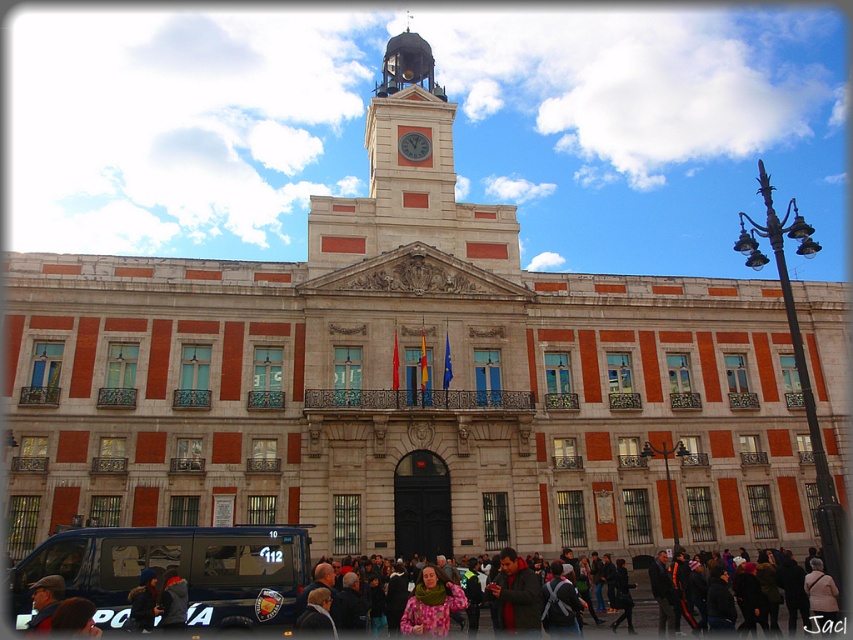
You are standing in front of the historic building and notice two points marked on the facade. The first point is at coordinate point (447,147) and the second is at point (407,627). Which point is closer to you?

Point (447,147) is further to the camera than point (407,627), so the point closer to you is point (407,627).

You are standing in front of the historic building and want to take a photo. You notice two points on the building marked as point 1 at coordinates [421,609] and point 2 at coordinates [415,131]. Which point is closer to your camera?

Point 1 at coordinates [421,609] is closer to the camera than point 2 at coordinates [415,131].